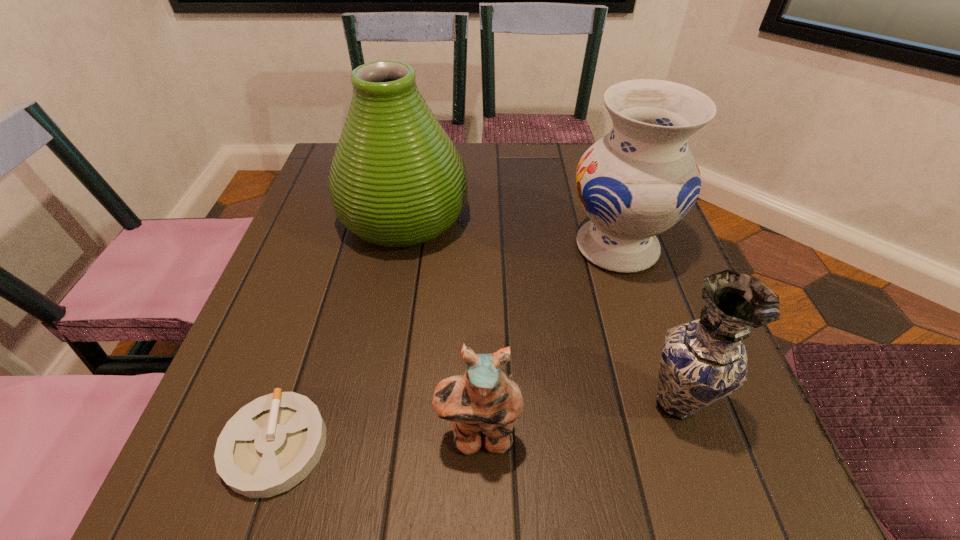
This screenshot has width=960, height=540. Identify the location of vacant area that lies between the leftmost vase and the figurine. (442, 328).

Locate an element on the screen. The image size is (960, 540). vacant area that lies between the leftmost vase and the fourth tallest object is located at coordinates (442, 328).

Where is `free space that is in between the ashtray and the fourth tallest object`? free space that is in between the ashtray and the fourth tallest object is located at coordinates (377, 442).

I want to click on vacant space that is in between the nearest vase and the second shortest object, so click(x=577, y=420).

Where is `free space between the nearest vase and the leftmost vase`? free space between the nearest vase and the leftmost vase is located at coordinates (540, 310).

You are a GUI agent. You are given a task and a screenshot of the screen. Output one action in this format:
    pyautogui.click(x=<x>, y=<y>)
    Task: Click on the free space between the nearest vase and the leftmost vase
    This screenshot has width=960, height=540.
    Given the screenshot: What is the action you would take?
    pyautogui.click(x=540, y=310)

The image size is (960, 540). Find the location of `free space between the leftmost vase and the shortest object`. free space between the leftmost vase and the shortest object is located at coordinates (340, 332).

Identify the location of object identified as the fourth closest to the second shortest object. (397, 180).

Locate which object ranks fourth in proximity to the nearest vase. Please provide its 2D coordinates. Your answer should be formatted as a tuple, i.e. [(x, y)], where the tuple contains the x and y coordinates of a point satisfying the conditions above.

[(271, 444)]

Choose which vase is the nearest neighbor to the ashtray. Please provide its 2D coordinates. Your answer should be formatted as a tuple, i.e. [(x, y)], where the tuple contains the x and y coordinates of a point satisfying the conditions above.

[(397, 180)]